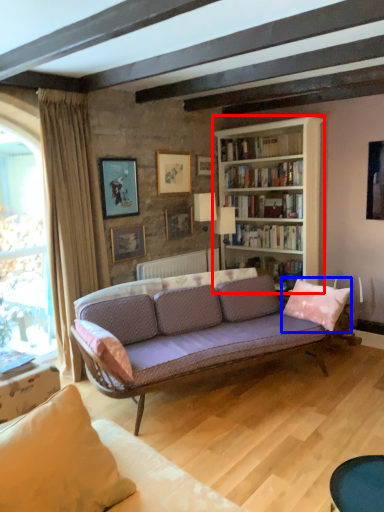
Question: Which point is further to the camera, bookcase (highlighted by a red box) or pillow (highlighted by a blue box)?

Choices:
 (A) bookcase
 (B) pillow

Answer: (A)